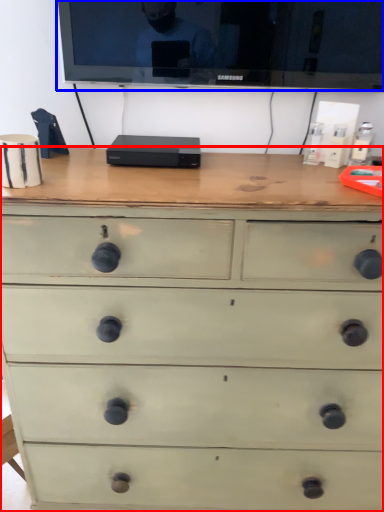
Question: Which point is closer to the camera, chest of drawers (highlighted by a red box) or television (highlighted by a blue box)?

Choices:
 (A) chest of drawers
 (B) television

Answer: (A)